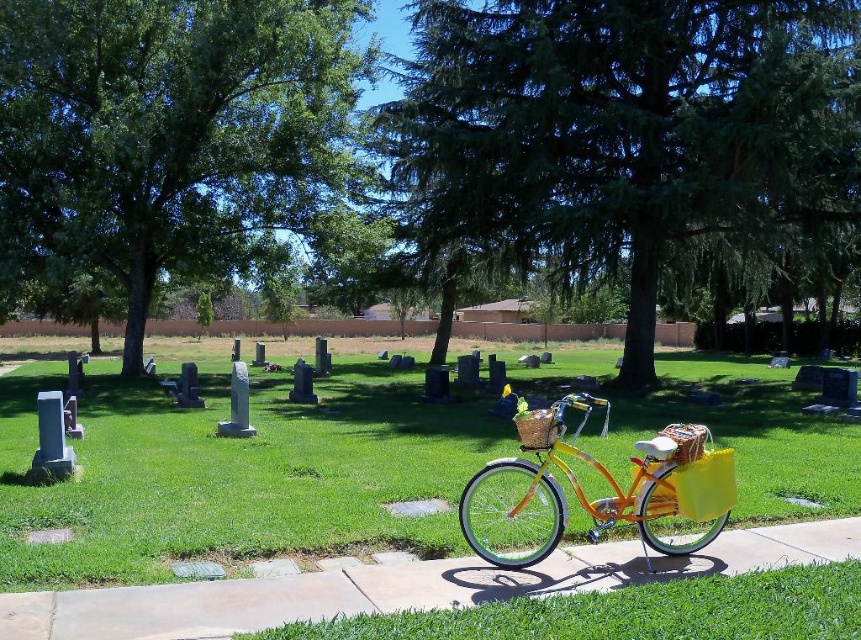
You are a gardener who needs to mow the lawn. Based on the scene, which area would require more time to mow, the green grass at center or the orange matte pavement at lower center?

The green grass at center is larger in size than the orange matte pavement at lower center, so it would require more time to mow the green grass at center.

You are standing at the center of the cemetery pathway and want to place a new flower bouquet exactly at the location where the matte wicker basket at center is currently located. According to the coordinates provided, what are the exact coordinates where you should place the bouquet?

The exact coordinates to place the bouquet are at point (537, 428), where the matte wicker basket at center is located.